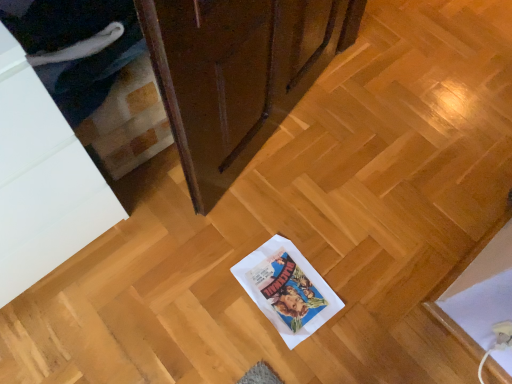
Where is `vacant area that lies in front of matte brown cabinet at upper center, positioned as the 1th cabinetry in right-to-left order`? The width and height of the screenshot is (512, 384). vacant area that lies in front of matte brown cabinet at upper center, positioned as the 1th cabinetry in right-to-left order is located at coordinates pos(254,242).